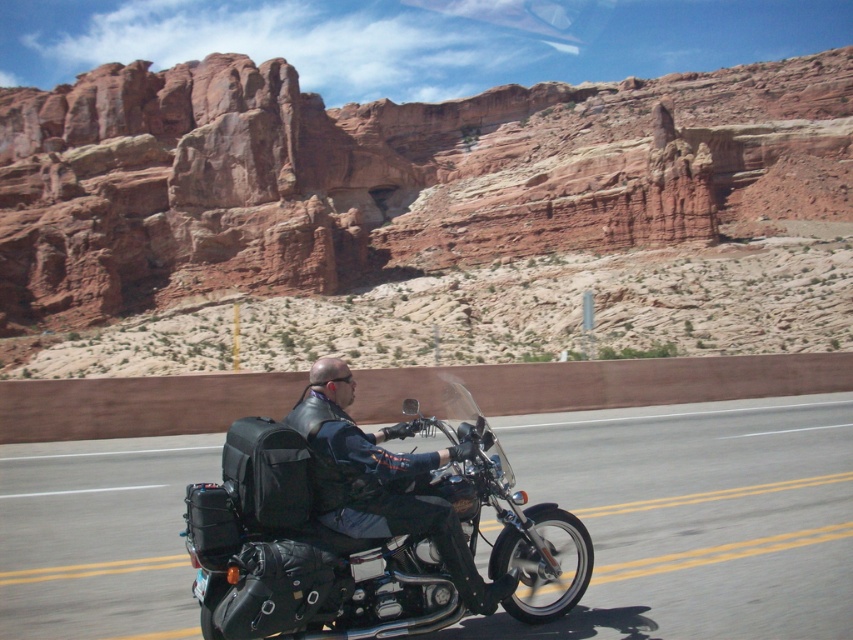
Question: Which object is farther from the camera taking this photo?

Choices:
 (A) black fabric backpack at lower left
 (B) black leather motorcycle at center

Answer: (B)

Question: Which object appears farthest from the camera in this image?

Choices:
 (A) shiny black motorcycle at center
 (B) black fabric backpack at lower left
 (C) black leather motorcycle at center

Answer: (A)

Question: Which point is farther to the camera?

Choices:
 (A) (326, 403)
 (B) (260, 445)

Answer: (A)

Question: Does black leather motorcycle at center appear over black fabric backpack at lower left?

Choices:
 (A) yes
 (B) no

Answer: (B)

Question: Can you confirm if black leather motorcycle at center is positioned to the left of black fabric backpack at lower left?

Choices:
 (A) yes
 (B) no

Answer: (B)

Question: Is shiny black motorcycle at center smaller than black fabric backpack at lower left?

Choices:
 (A) no
 (B) yes

Answer: (A)